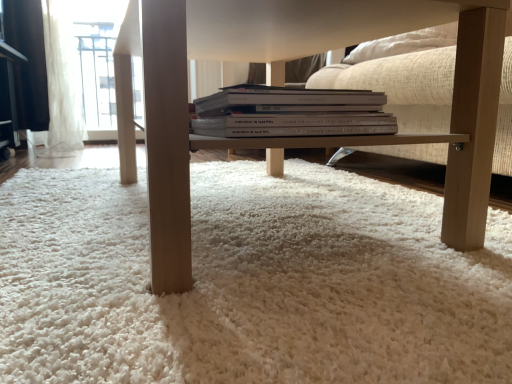
The image size is (512, 384). What are the coordinates of `free spot below light wood table at center (from a real-world perspective)` in the screenshot? It's located at (253, 198).